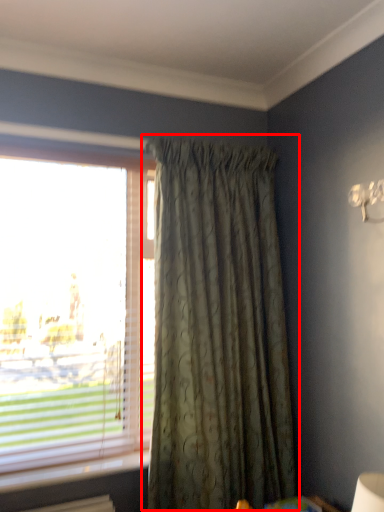
Question: Observing the image, what is the correct spatial positioning of curtain (annotated by the red box) in reference to window?

Choices:
 (A) right
 (B) left

Answer: (A)